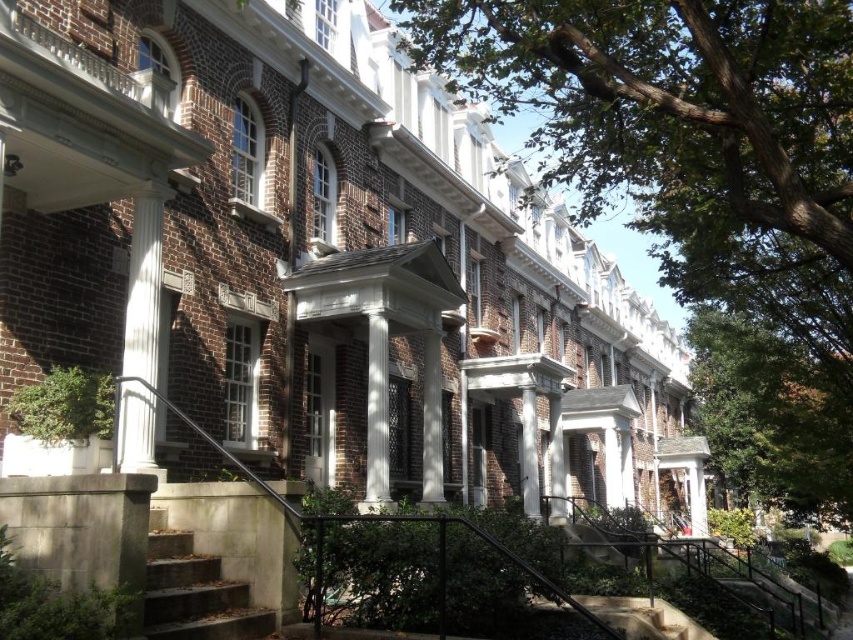
Does concrete steps at lower left appear on the left side of white glossy column at left?

No, concrete steps at lower left is not to the left of white glossy column at left.

How far apart are concrete steps at lower left and white glossy column at left?

They are 9.43 feet apart.

Image resolution: width=853 pixels, height=640 pixels. I want to click on concrete steps at lower left, so click(194, 593).

Identify the location of concrete steps at lower left. (194, 593).

Does green leafy tree at upper right have a smaller size compared to white glossy column at left?

Actually, green leafy tree at upper right might be larger than white glossy column at left.

Is point (770, 195) farther from viewer compared to point (132, 394)?

Yes, point (770, 195) is farther from viewer.

Where is `green leafy tree at upper right`? The width and height of the screenshot is (853, 640). green leafy tree at upper right is located at coordinates (701, 188).

Looking at this image, is green leafy tree at upper right further to camera compared to concrete steps at lower left?

That is True.

Is point (730, 12) farther from viewer compared to point (244, 612)?

Yes.

Find the location of a particular element. Image resolution: width=853 pixels, height=640 pixels. green leafy tree at upper right is located at coordinates (x=701, y=188).